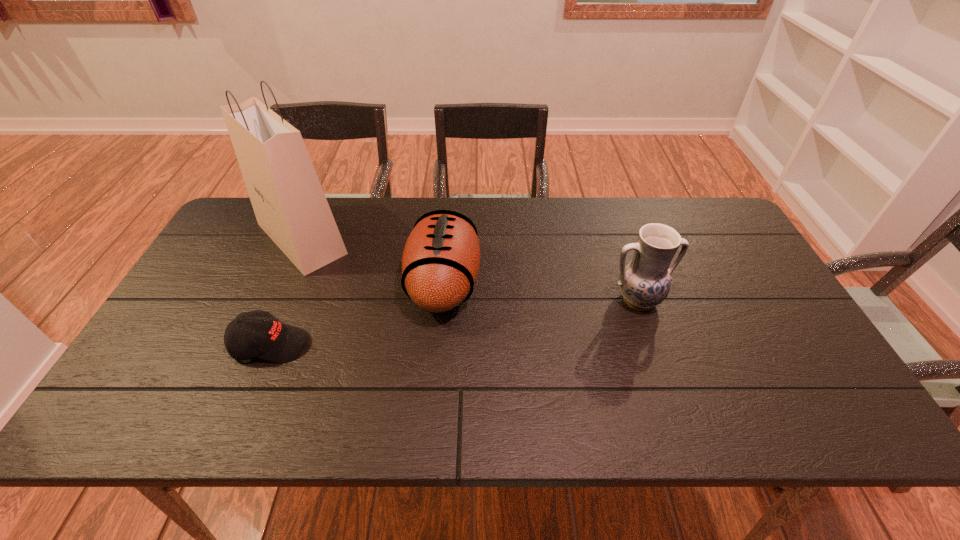
Find the location of a particular element. The height and width of the screenshot is (540, 960). free space between the rightmost object and the third tallest object is located at coordinates (540, 291).

The width and height of the screenshot is (960, 540). Find the location of `free space between the tallest object and the football (American)`. free space between the tallest object and the football (American) is located at coordinates click(372, 261).

Image resolution: width=960 pixels, height=540 pixels. I want to click on free spot between the rightmost object and the football (American), so tap(540, 291).

The height and width of the screenshot is (540, 960). I want to click on free space between the rightmost object and the baseball cap, so click(x=454, y=322).

The height and width of the screenshot is (540, 960). In order to click on free spot between the shortest object and the tallest object in this screenshot , I will do `click(286, 292)`.

Identify which object is located as the third nearest to the baseball cap. Please provide its 2D coordinates. Your answer should be formatted as a tuple, i.e. [(x, y)], where the tuple contains the x and y coordinates of a point satisfying the conditions above.

[(644, 282)]

Identify the location of the closest object to the second shortest object. The height and width of the screenshot is (540, 960). (290, 206).

Where is `free spot that satisfies the following two spatial constraints: 1. on the front side of the rightmost object; 2. on the right side of the tallest object`? The image size is (960, 540). free spot that satisfies the following two spatial constraints: 1. on the front side of the rightmost object; 2. on the right side of the tallest object is located at coordinates (275, 300).

Where is `vacant point that satisfies the following two spatial constraints: 1. on the front side of the pottery; 2. on the right side of the tallest object`? The image size is (960, 540). vacant point that satisfies the following two spatial constraints: 1. on the front side of the pottery; 2. on the right side of the tallest object is located at coordinates (275, 300).

At what (x,y) coordinates should I click in order to perform the action: click on free region that satisfies the following two spatial constraints: 1. on the front side of the tallest object; 2. on the right side of the second object from right to left. Please return your answer as a coordinate pair (x, y). This screenshot has height=540, width=960. Looking at the image, I should click on (281, 283).